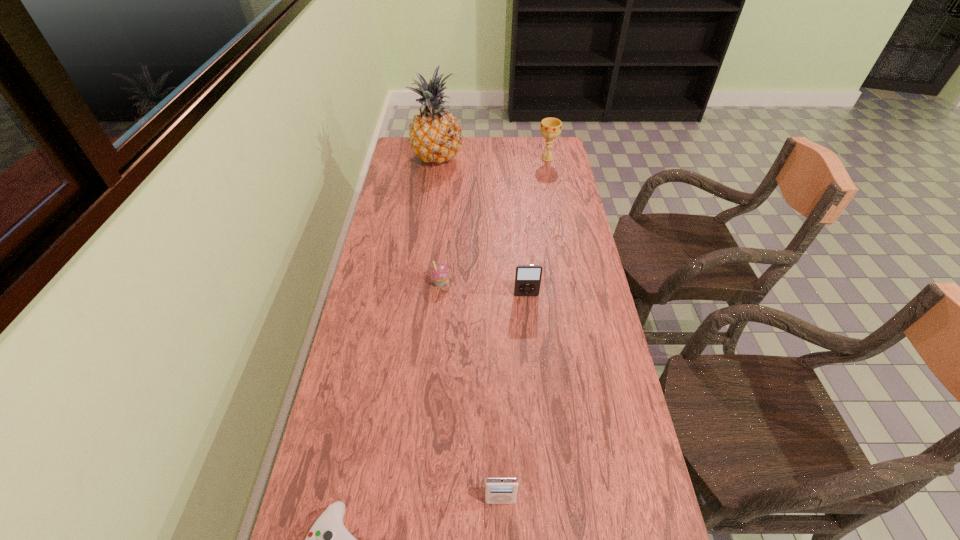
Find the location of `vacant space located on the front-facing side of the farther iPod`. vacant space located on the front-facing side of the farther iPod is located at coordinates (528, 314).

This screenshot has height=540, width=960. What are the coordinates of `vacant region located on the front-facing side of the nearer iPod` in the screenshot? It's located at (501, 530).

In order to click on vacant space located 0.120m on the left of the cupcake in this screenshot , I will do pos(392,281).

Find the location of `pineapple that is at the far edge`. pineapple that is at the far edge is located at coordinates (435, 135).

The image size is (960, 540). What are the coordinates of `chalice present at the far edge` in the screenshot? It's located at (550, 128).

You are a GUI agent. You are given a task and a screenshot of the screen. Output one action in this format:
    pyautogui.click(x=<x>, y=<y>)
    Task: Click on the object that is at the left edge
    
    Given the screenshot: What is the action you would take?
    pyautogui.click(x=435, y=135)

The width and height of the screenshot is (960, 540). I want to click on object that is positioned at the right edge, so click(550, 128).

Where is `object at the far left corner`? Image resolution: width=960 pixels, height=540 pixels. object at the far left corner is located at coordinates (435, 135).

I want to click on object located at the far right corner, so click(x=550, y=128).

Identify the location of free space at the far edge of the desktop. This screenshot has height=540, width=960. (501, 153).